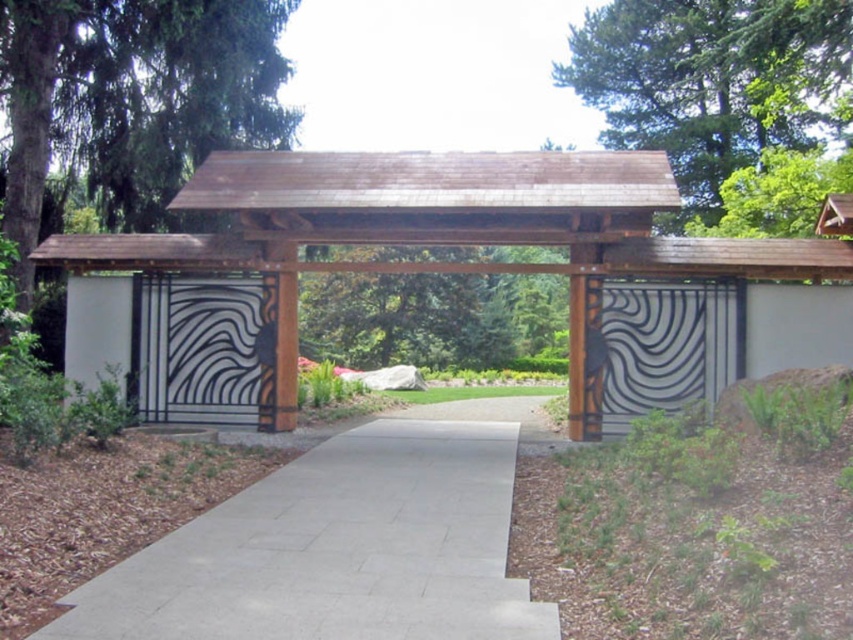
Question: Which of the following is the closest to the observer?

Choices:
 (A) brown wood gazebo at center
 (B) gray concrete pavement at center
 (C) metallic silver gate at center

Answer: (B)

Question: Which of these objects is positioned closest to the brown wood gazebo at center?

Choices:
 (A) metallic silver gate at center
 (B) black metal gate at center

Answer: (A)

Question: From the image, what is the correct spatial relationship of brown wood gazebo at center in relation to metallic silver gate at center?

Choices:
 (A) below
 (B) above

Answer: (B)

Question: Based on their relative distances, which object is nearer to the gray concrete pavement at center?

Choices:
 (A) metallic silver gate at center
 (B) black metal gate at center
 (C) brown wood gazebo at center

Answer: (B)

Question: Does gray concrete pavement at center have a smaller size compared to black metal gate at center?

Choices:
 (A) no
 (B) yes

Answer: (A)

Question: Is gray concrete pavement at center to the right of black metal gate at center from the viewer's perspective?

Choices:
 (A) yes
 (B) no

Answer: (B)